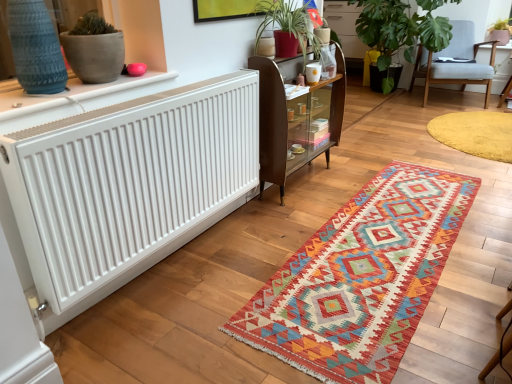
This screenshot has height=384, width=512. Find the location of `free region under wooden glass-fronted cabinet at center (from a real-world perspective)`. free region under wooden glass-fronted cabinet at center (from a real-world perspective) is located at coordinates (302, 176).